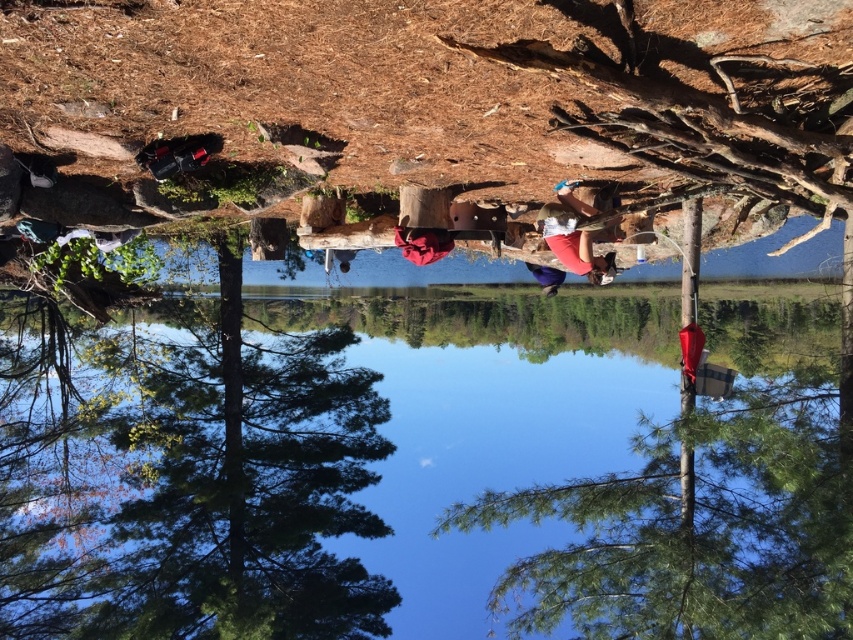
You are standing in the rotated landscape scene. You see the transparent water at center and the matte red shorts at center. Which object is closer to you?

The transparent water at center is closer to you than the matte red shorts at center.

From the picture: You are a photographer trying to capture the transparent water at center and the matte red shorts at center in a single shot. Which object appears taller in the frame?

The transparent water at center appears taller than the matte red shorts at center in the frame.

You are standing at the center of the image and want to walk towards the two points labeled as point (x=439, y=314) and point (x=851, y=541). Which point will you reach first?

You will reach point (x=439, y=314) first because it is closer to you than point (x=851, y=541), which is further away.